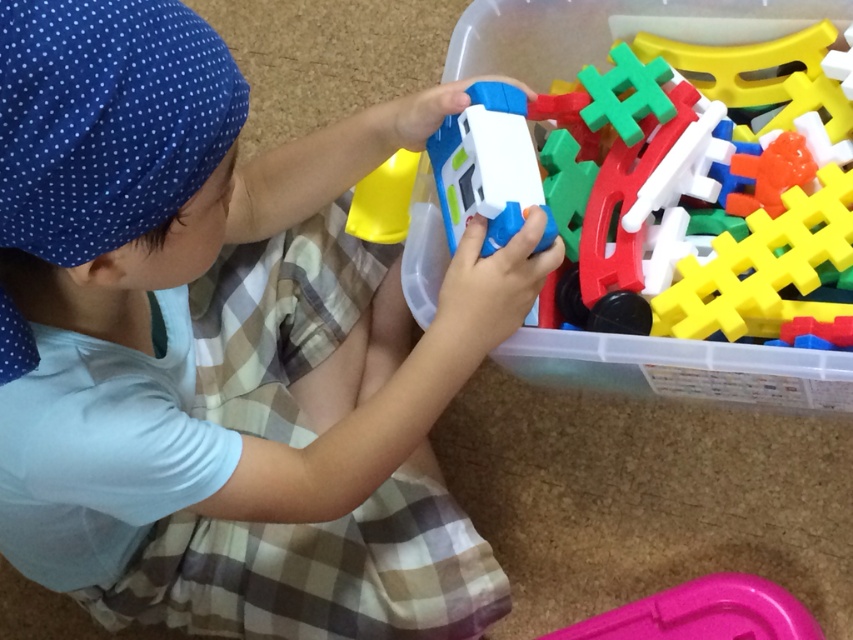
You are a parent standing 36 inches away from the blue plastic toy car at center. Can you reach it without moving your feet?

The blue plastic toy car at center is 35.19 inches away from the viewer. Since you are standing 36 inches away, you are slightly farther than the car, so you might not be able to reach it without moving closer.